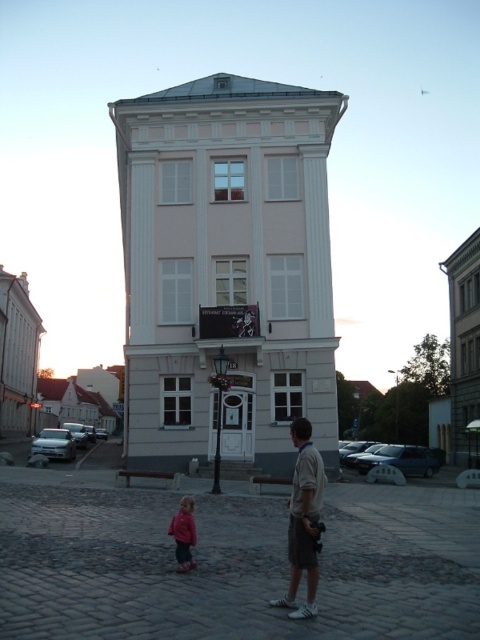
You are a photographer trying to capture the man and child in front of the tilted pink building. The light brown cotton shirt at center and pink fleece jacket at lower center are part of their outfits. Which clothing item is positioned higher up on the person?

The light brown cotton shirt at center is taller than the pink fleece jacket at lower center, so the light brown cotton shirt at center is positioned higher up on the person.

You are a photographer trying to capture the man and child in front of the tilted pink building. The light brown cotton shirt at center and the pink fleece jacket at lower center are part of the man and child. Which clothing item is positioned closer to the camera?

The light brown cotton shirt at center is closer to the viewer than the pink fleece jacket at lower center, so the light brown cotton shirt at center would appear closer to the camera.

You are standing at the camera position and want to take a photo of the white smooth building at center. If your camera has a maximum focus range of 25 meters, will you be able to capture the building clearly?

The white smooth building at center and camera are 28.19 meters apart, which exceeds the camera maximum focus range of 25 meters. Therefore, the building will be out of focus and not captured clearly.